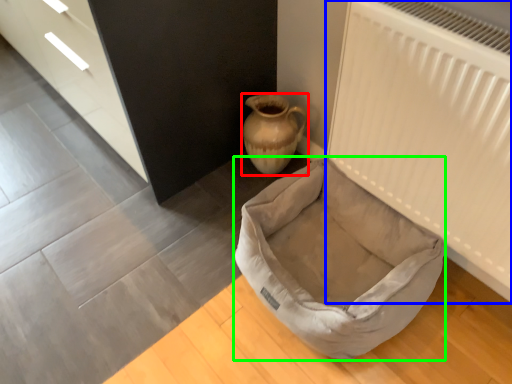
Question: Which object is the closest to the vase (highlighted by a red box)? Choose among these: radiator (highlighted by a blue box) or dog bed (highlighted by a green box).

Choices:
 (A) radiator
 (B) dog bed

Answer: (B)